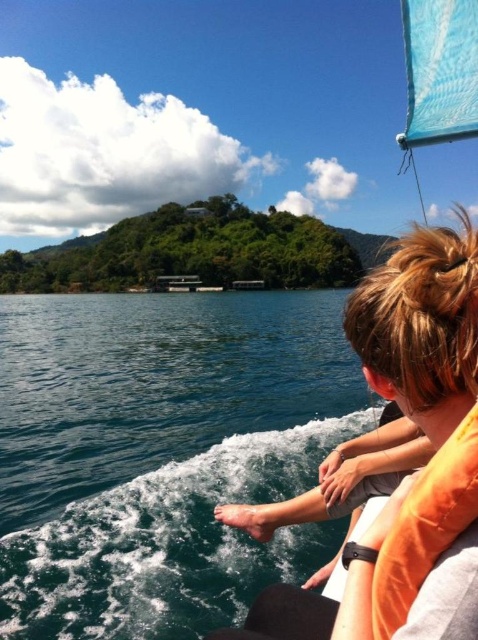
Does deep blue water at lower left appear under orange fabric life jacket at lower right?

Indeed, deep blue water at lower left is positioned under orange fabric life jacket at lower right.

Is point (223, 371) positioned after point (376, 612)?

Yes, point (223, 371) is behind point (376, 612).

Find the location of a particular element. This screenshot has height=640, width=478. deep blue water at lower left is located at coordinates (162, 454).